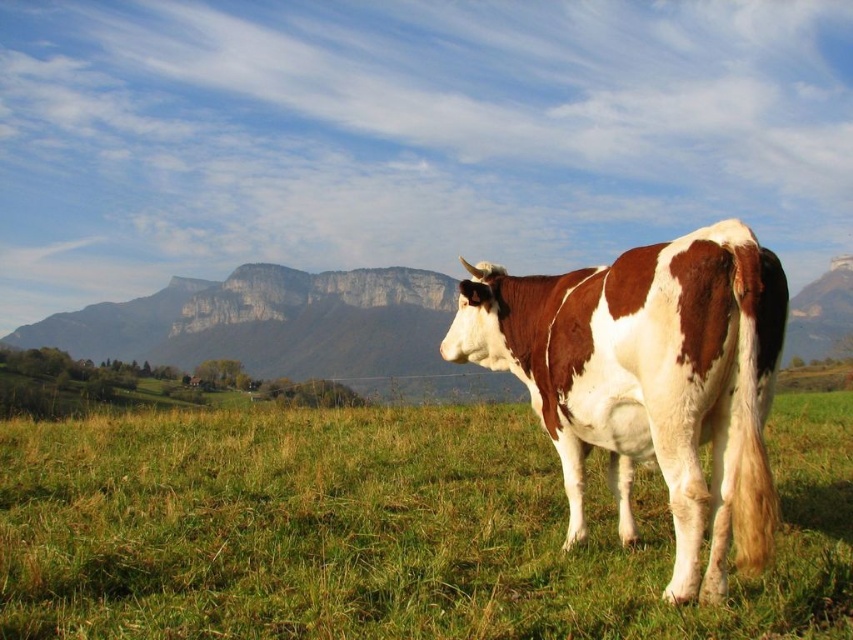
Question: Can you confirm if green grassy at center is thinner than brown and white speckled cow at center?

Choices:
 (A) no
 (B) yes

Answer: (A)

Question: Where is green grassy at center located in relation to brown and white speckled cow at center in the image?

Choices:
 (A) right
 (B) left

Answer: (B)

Question: Which object is farther from the camera taking this photo?

Choices:
 (A) green grassy at center
 (B) brown and white speckled cow at center

Answer: (A)

Question: Is green grassy at center below brown and white speckled cow at center?

Choices:
 (A) no
 (B) yes

Answer: (B)